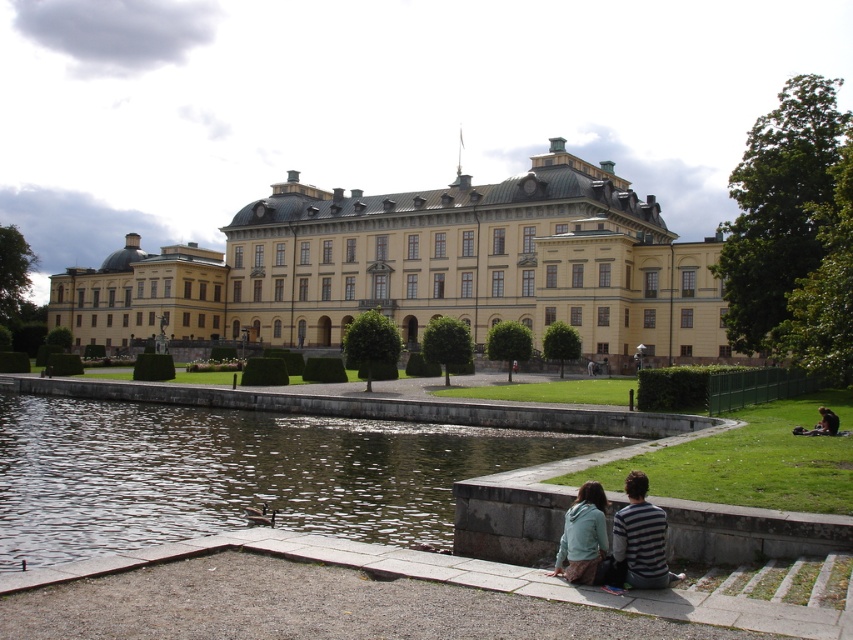
You are standing at the starting point of the pathway leading to the grand historical building. You see two points marked on the path ahead. The first point is at coordinates point (318, 278) and the second is at point (177, 472). Which point will you encounter first as you walk towards the building?

Point (177, 472) will be encountered first because it is in front of point (318, 278), which is further back along the pathway towards the building.

You are standing at the point marked by coordinates point (428, 268). Looking around, you see the yellow stone building at center. Which direction should you walk to reach the building?

The point (428, 268) is located at the yellow stone building at center, so you are already at the building.

You are standing on the paved pathway near the water and want to approach the yellow stone building at center. Which direction should you walk to reach it from the light blue hoodie at lower center?

The yellow stone building at center is located above the light blue hoodie at lower center, so you should walk upwards or towards the center to reach it.